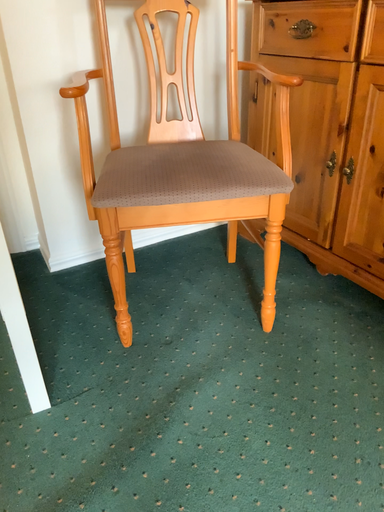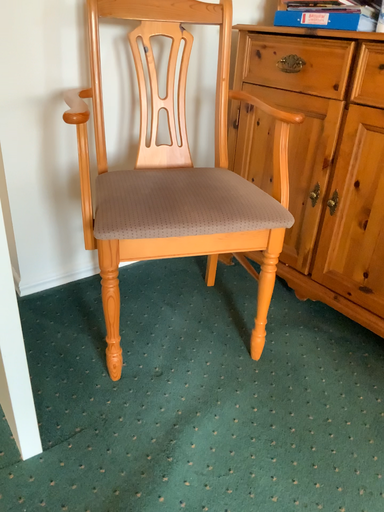
Question: Which way did the camera rotate in the video?

Choices:
 (A) rotated right
 (B) rotated left

Answer: (A)